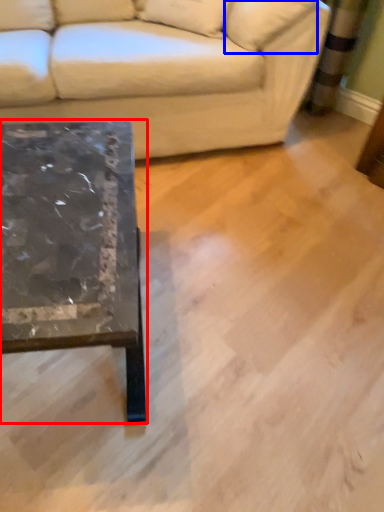
Question: Which object is closer to the camera taking this photo, coffee table (highlighted by a red box) or pillow (highlighted by a blue box)?

Choices:
 (A) coffee table
 (B) pillow

Answer: (A)